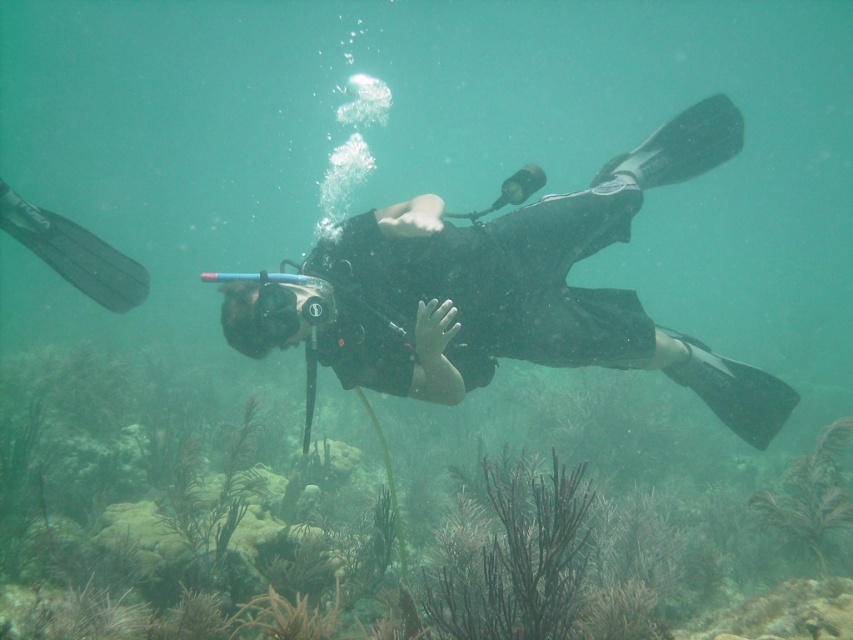
Question: Which of the following is the closest to the observer?

Choices:
 (A) matte black goggles at center
 (B) brown coral at center

Answer: (B)

Question: Does brown coral at center appear over matte black goggles at center?

Choices:
 (A) yes
 (B) no

Answer: (B)

Question: Does brown coral at center come in front of matte black goggles at center?

Choices:
 (A) no
 (B) yes

Answer: (B)

Question: Which object is closer to the camera taking this photo?

Choices:
 (A) black matte scuba diver at center
 (B) matte black goggles at center

Answer: (A)

Question: Can you confirm if black matte scuba diver at center is thinner than matte black goggles at center?

Choices:
 (A) yes
 (B) no

Answer: (B)

Question: Which point is closer to the camera taking this photo?

Choices:
 (A) (78, 532)
 (B) (264, 323)
 (C) (553, 209)

Answer: (B)